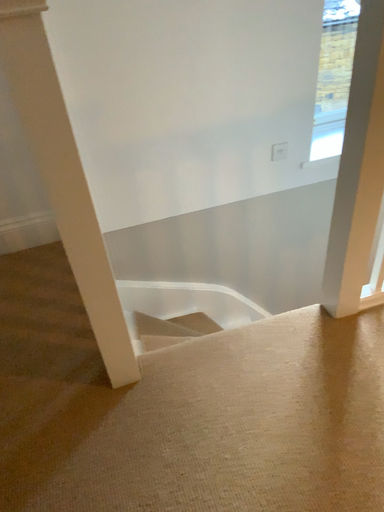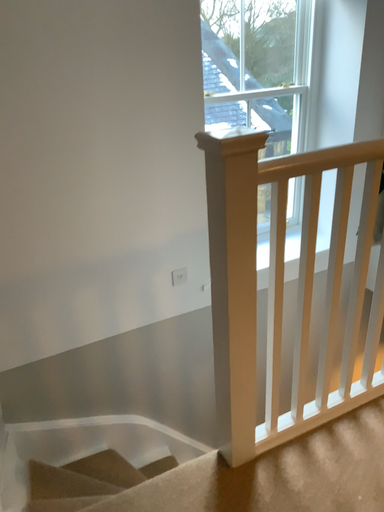
Question: How did the camera likely rotate when shooting the video?

Choices:
 (A) rotated downward
 (B) rotated upward

Answer: (B)